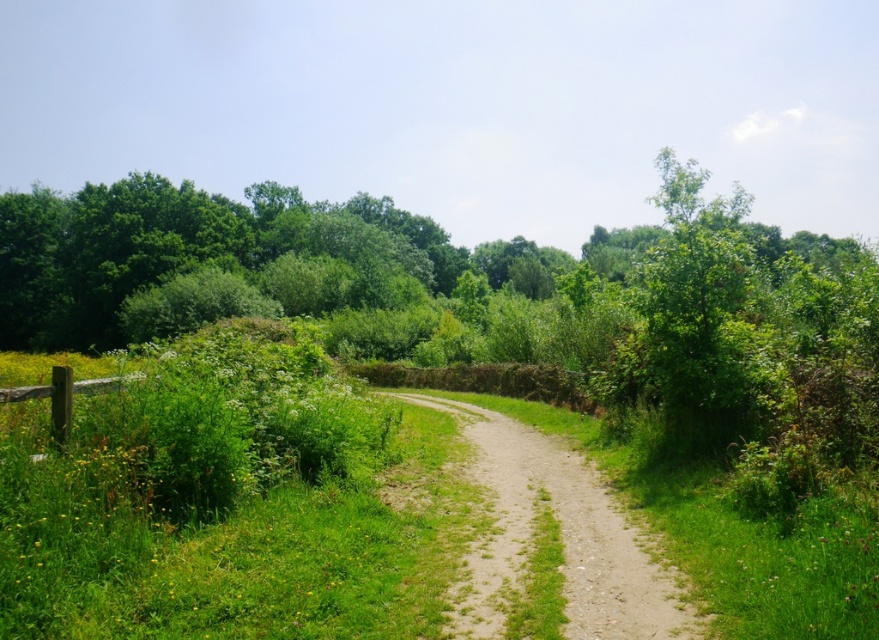
Who is higher up, dirt/gravel path at center or brown wooden fence at lower left?

brown wooden fence at lower left

The width and height of the screenshot is (879, 640). I want to click on dirt/gravel path at center, so click(560, 536).

Does point (463, 634) lie behind point (105, 385)?

No, it is not.

Image resolution: width=879 pixels, height=640 pixels. I want to click on dirt/gravel path at center, so click(560, 536).

Does green grass at center lie in front of dirt/gravel path at center?

Yes, green grass at center is closer to the viewer.

Can you confirm if green grass at center is taller than dirt/gravel path at center?

Indeed, green grass at center has a greater height compared to dirt/gravel path at center.

Between point (47, 502) and point (670, 632), which one is positioned behind?

The point (47, 502) is behind.

Where is `green grass at center`? green grass at center is located at coordinates (240, 552).

Does green grass at center appear on the right side of brown wooden fence at lower left?

Indeed, green grass at center is positioned on the right side of brown wooden fence at lower left.

Which of these two, green grass at center or brown wooden fence at lower left, stands shorter?

brown wooden fence at lower left is shorter.

Between point (382, 509) and point (60, 444), which one is positioned in front?

Point (60, 444) is in front.

Image resolution: width=879 pixels, height=640 pixels. Identify the location of green grass at center. (240, 552).